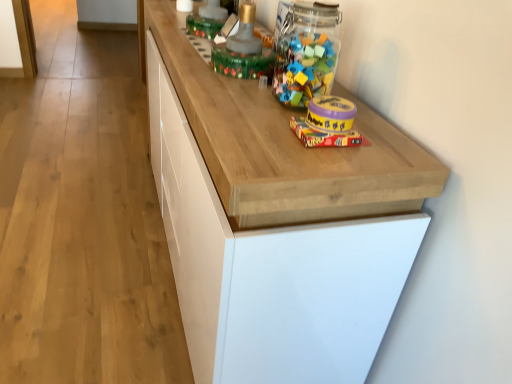
What is the approximate width of wooden cabinet at center?

wooden cabinet at center is 18.13 inches in width.

Identify the location of translucent plastic container at upper center, which is the first toy from back to front. The height and width of the screenshot is (384, 512). (207, 20).

Which is closer, (x=361, y=328) or (x=229, y=50)?

Positioned in front is point (x=361, y=328).

Is translucent glass jar at upper center, which is counted as the 2th toy, starting from the back, at the back of wooden cabinet at center?

No.

Is wooden cabinet at center completely or partially outside of translucent glass jar at upper center, positioned as the third toy in front-to-back order?

Yes, wooden cabinet at center is not within translucent glass jar at upper center, positioned as the third toy in front-to-back order.

Is wooden cabinet at center bigger or smaller than translucent glass jar at upper center, which is counted as the 2th toy, starting from the back?

wooden cabinet at center is bigger than translucent glass jar at upper center, which is counted as the 2th toy, starting from the back.

Considering the sizes of translucent plastic container at upper center, which appears as the 4th toy when ordered from the bottom, and matte yellow plastic container at upper right, the fourth toy from the back, in the image, is translucent plastic container at upper center, which appears as the 4th toy when ordered from the bottom, bigger or smaller than matte yellow plastic container at upper right, the fourth toy from the back,?

In the image, translucent plastic container at upper center, which appears as the 4th toy when ordered from the bottom, appears to be larger than matte yellow plastic container at upper right, the fourth toy from the back.

Considering the sizes of objects translucent plastic container at upper center, which is counted as the first toy, starting from the top, and matte yellow plastic container at upper right, positioned as the first toy in front-to-back order, in the image provided, who is taller, translucent plastic container at upper center, which is counted as the first toy, starting from the top, or matte yellow plastic container at upper right, positioned as the first toy in front-to-back order,?

translucent plastic container at upper center, which is counted as the first toy, starting from the top, is taller.

Which is correct: translucent plastic container at upper center, which appears as the 4th toy when ordered from the bottom, is inside matte yellow plastic container at upper right, which ranks as the third toy in top-to-bottom order, or outside of it?

translucent plastic container at upper center, which appears as the 4th toy when ordered from the bottom, is not enclosed by matte yellow plastic container at upper right, which ranks as the third toy in top-to-bottom order.

Is translucent glass jar at upper center, which is counted as the 2th toy, starting from the back, facing away from translucent plastic container at upper center, the 4th toy when ordered from front to back?

translucent glass jar at upper center, which is counted as the 2th toy, starting from the back, does not have its back to translucent plastic container at upper center, the 4th toy when ordered from front to back.

Does translucent glass jar at upper center, the second toy from the top, come in front of translucent plastic container at upper center, which appears as the 4th toy when ordered from the bottom?

Yes, it is in front of translucent plastic container at upper center, which appears as the 4th toy when ordered from the bottom.

Which of these two, translucent glass jar at upper center, the second toy from the top, or translucent plastic container at upper center, which is the first toy from back to front, is bigger?

translucent glass jar at upper center, the second toy from the top.

From a real-world perspective, is matte yellow plastic container at center, the second toy in the front-to-back sequence, physically located above or below translucent plastic container at upper center, which is counted as the first toy, starting from the top?

From a real-world perspective, matte yellow plastic container at center, the second toy in the front-to-back sequence, is physically below translucent plastic container at upper center, which is counted as the first toy, starting from the top.

Is matte yellow plastic container at center, which ranks as the first toy in bottom-to-top order, positioned with its back to translucent plastic container at upper center, the 4th toy when ordered from front to back?

No, translucent plastic container at upper center, the 4th toy when ordered from front to back, is not at the back of matte yellow plastic container at center, which ranks as the first toy in bottom-to-top order.

Which object is thinner, matte yellow plastic container at center, which is the fourth toy from top to bottom, or translucent plastic container at upper center, which is counted as the first toy, starting from the top?

matte yellow plastic container at center, which is the fourth toy from top to bottom, is thinner.

From the image's perspective, is matte yellow plastic container at center, which is the fourth toy from top to bottom, located above or below translucent plastic container at upper center, which is counted as the first toy, starting from the top?

Clearly, from the image's perspective, matte yellow plastic container at center, which is the fourth toy from top to bottom, is below translucent plastic container at upper center, which is counted as the first toy, starting from the top.

From a real-world perspective, is translucent glass jar at upper center, which is counted as the 2th toy, starting from the back, below matte yellow plastic container at center, which ranks as the first toy in bottom-to-top order?

No, from a real-world perspective, translucent glass jar at upper center, which is counted as the 2th toy, starting from the back, is not below matte yellow plastic container at center, which ranks as the first toy in bottom-to-top order.

Is matte yellow plastic container at center, which ranks as the first toy in bottom-to-top order, a part of translucent glass jar at upper center, positioned as the third toy in front-to-back order?

No, matte yellow plastic container at center, which ranks as the first toy in bottom-to-top order, is not surrounded by translucent glass jar at upper center, positioned as the third toy in front-to-back order.

Does translucent glass jar at upper center, which is counted as the 2th toy, starting from the back, have a smaller size compared to matte yellow plastic container at center, which is the third toy from back to front?

No, translucent glass jar at upper center, which is counted as the 2th toy, starting from the back, is not smaller than matte yellow plastic container at center, which is the third toy from back to front.

Which is closer, (237, 55) or (340, 137)?

The point (340, 137) is closer to the camera.

Considering the relative sizes of wooden cabinet at center and matte yellow plastic container at upper right, acting as the 2th toy starting from the bottom, in the image provided, is wooden cabinet at center shorter than matte yellow plastic container at upper right, acting as the 2th toy starting from the bottom,?

No.

Which point is more forward, (381, 334) or (323, 108)?

The point (323, 108) is in front.

You are a GUI agent. You are given a task and a screenshot of the screen. Output one action in this format:
    pyautogui.click(x=<x>, y=<y>)
    Task: Click on the toy that is the 1st one when counting backward from the wooden cabinet at center
    The height and width of the screenshot is (384, 512).
    Given the screenshot: What is the action you would take?
    pyautogui.click(x=331, y=114)

Choose the correct answer: Is translucent plastic container at upper center, which is counted as the first toy, starting from the top, inside wooden cabinet at center or outside it?

translucent plastic container at upper center, which is counted as the first toy, starting from the top, is located beyond the bounds of wooden cabinet at center.

From a real-world perspective, does translucent plastic container at upper center, the 4th toy when ordered from front to back, sit lower than wooden cabinet at center?

Actually, translucent plastic container at upper center, the 4th toy when ordered from front to back, is physically above wooden cabinet at center in the real world.

Does point (192, 16) lie behind point (279, 233)?

Yes, point (192, 16) is behind point (279, 233).

You are a GUI agent. You are given a task and a screenshot of the screen. Output one action in this format:
    pyautogui.click(x=<x>, y=<y>)
    Task: Click on the cabinetry directly beneath the translucent plastic container at upper center, which is the first toy from back to front (from a real-world perspective)
    This screenshot has width=512, height=384.
    Given the screenshot: What is the action you would take?
    tap(277, 223)

Find the location of a particular element. The height and width of the screenshot is (384, 512). cabinetry in front of the translucent glass jar at upper center, the second toy from the top is located at coordinates (277, 223).

You are a GUI agent. You are given a task and a screenshot of the screen. Output one action in this format:
    pyautogui.click(x=<x>, y=<y>)
    Task: Click on the 2nd toy counting from the left of the matte yellow plastic container at upper right, the fourth toy from the back
    This screenshot has height=384, width=512.
    Given the screenshot: What is the action you would take?
    pyautogui.click(x=207, y=20)

Based on their spatial positions, is matte yellow plastic container at upper right, acting as the 2th toy starting from the bottom, or translucent plastic container at upper center, which appears as the 4th toy when ordered from the bottom, further from wooden cabinet at center?

Based on the image, translucent plastic container at upper center, which appears as the 4th toy when ordered from the bottom, appears to be further to wooden cabinet at center.

From the image, which object appears to be nearer to translucent glass jar at upper center, the 3th toy ordered from the bottom, translucent plastic container at upper center, which is the first toy from back to front, or wooden cabinet at center?

translucent plastic container at upper center, which is the first toy from back to front, is positioned closer to the anchor translucent glass jar at upper center, the 3th toy ordered from the bottom.

Based on their spatial positions, is wooden cabinet at center or matte yellow plastic container at center, which is the fourth toy from top to bottom, closer to translucent plastic container at upper center, which is the first toy from back to front?

Based on the image, wooden cabinet at center appears to be nearer to translucent plastic container at upper center, which is the first toy from back to front.

When comparing their distances from translucent glass jar at upper center, positioned as the third toy in front-to-back order, does matte yellow plastic container at upper right, acting as the 2th toy starting from the bottom, or matte yellow plastic container at center, which is the third toy from back to front, seem closer?

matte yellow plastic container at upper right, acting as the 2th toy starting from the bottom.

Looking at the image, which one is located closer to matte yellow plastic container at center, which ranks as the first toy in bottom-to-top order, matte yellow plastic container at upper right, the fourth toy from the back, or wooden cabinet at center?

Based on the image, matte yellow plastic container at upper right, the fourth toy from the back, appears to be nearer to matte yellow plastic container at center, which ranks as the first toy in bottom-to-top order.

From the image, which object appears to be farther from wooden cabinet at center, matte yellow plastic container at center, the second toy in the front-to-back sequence, or translucent glass jar at upper center, the second toy from the top?

Based on the image, translucent glass jar at upper center, the second toy from the top, appears to be further to wooden cabinet at center.

When comparing their distances from translucent plastic container at upper center, which is the first toy from back to front, does matte yellow plastic container at center, which is the fourth toy from top to bottom, or wooden cabinet at center seem closer?

Based on the image, wooden cabinet at center appears to be nearer to translucent plastic container at upper center, which is the first toy from back to front.

Considering their positions, is translucent plastic container at upper center, the 4th toy when ordered from front to back, positioned closer to translucent glass jar at upper center, the second toy from the top, than matte yellow plastic container at upper right, positioned as the first toy in front-to-back order?

translucent plastic container at upper center, the 4th toy when ordered from front to back, is closer to translucent glass jar at upper center, the second toy from the top.

The width and height of the screenshot is (512, 384). I want to click on toy between matte yellow plastic container at center, which ranks as the first toy in bottom-to-top order, and translucent plastic container at upper center, the 4th toy when ordered from front to back, along the z-axis, so [243, 51].

You are a GUI agent. You are given a task and a screenshot of the screen. Output one action in this format:
    pyautogui.click(x=<x>, y=<y>)
    Task: Click on the toy between translucent glass jar at upper center, positioned as the third toy in front-to-back order, and matte yellow plastic container at center, the second toy in the front-to-back sequence, from top to bottom
    Image resolution: width=512 pixels, height=384 pixels.
    Given the screenshot: What is the action you would take?
    pyautogui.click(x=331, y=114)